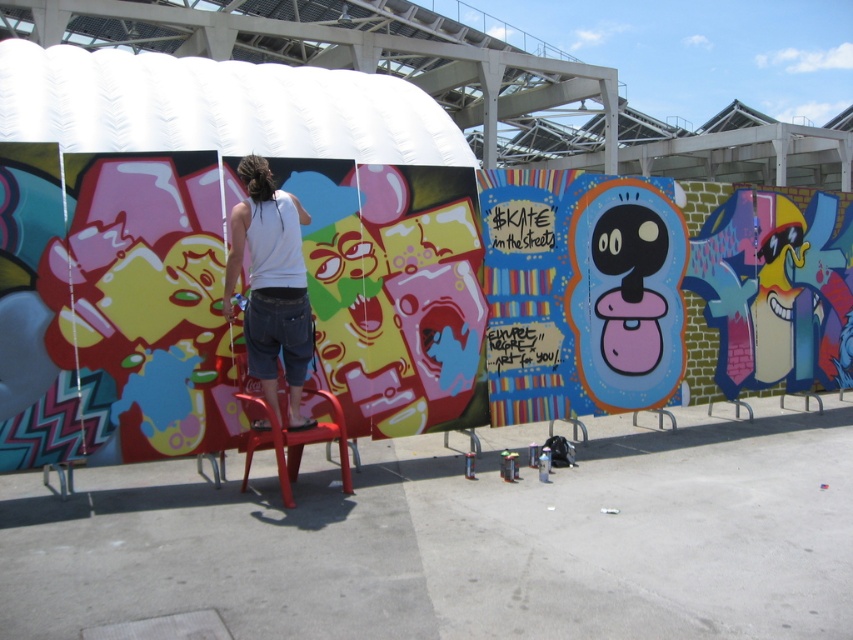
Is white cotton tank top at center positioned behind plastic red chair at center?

Yes, white cotton tank top at center is behind plastic red chair at center.

Which is below, white cotton tank top at center or plastic red chair at center?

plastic red chair at center is below.

You are a GUI agent. You are given a task and a screenshot of the screen. Output one action in this format:
    pyautogui.click(x=<x>, y=<y>)
    Task: Click on the white cotton tank top at center
    This screenshot has height=640, width=853.
    Given the screenshot: What is the action you would take?
    pyautogui.click(x=271, y=285)

At what (x,y) coordinates should I click in order to perform the action: click on white cotton tank top at center. Please return your answer as a coordinate pair (x, y). The image size is (853, 640). Looking at the image, I should click on (271, 285).